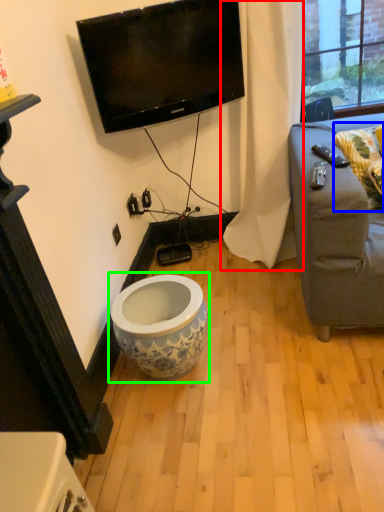
Question: Based on their relative distances, which object is farther from curtain (highlighted by a red box)? Choose from pillow (highlighted by a blue box) and toilet (highlighted by a green box).

Choices:
 (A) pillow
 (B) toilet

Answer: (B)